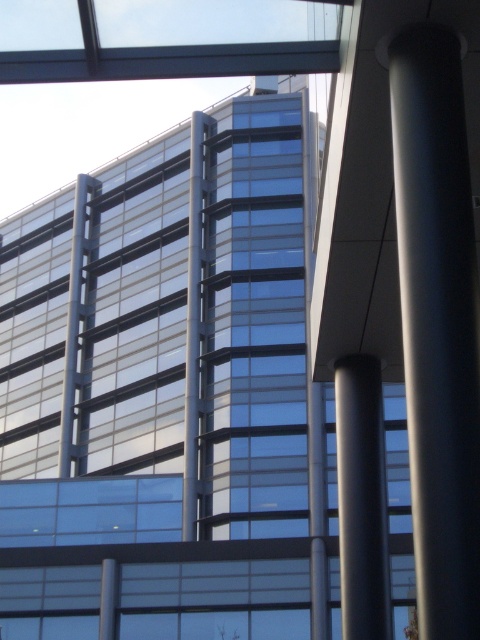
You are an architect designing a new building and want to ensure there is enough space between the satin black column at right and the smooth gray column at center for a 15 feet wide sculpture. Can the sculpture fit between them?

The satin black column at right and smooth gray column at center are 16.49 feet apart, so the 15 feet wide sculpture can fit between them since the distance is sufficient.

You are an architect reviewing the building design. You notice two columns in the facade, the satin black column at right and the smooth gray column at center. Which column is positioned higher in the structure?

The satin black column at right is positioned higher in the structure as it is above the smooth gray column at center.

You are standing in front of the modern building and notice two points marked on its facade. The first point is located at coordinates point (422, 454), and the second point is at point (371, 467). Which of these two points appears closer to you when observing the building from your current position?

Point (422, 454) is closer to the viewer than point (371, 467).